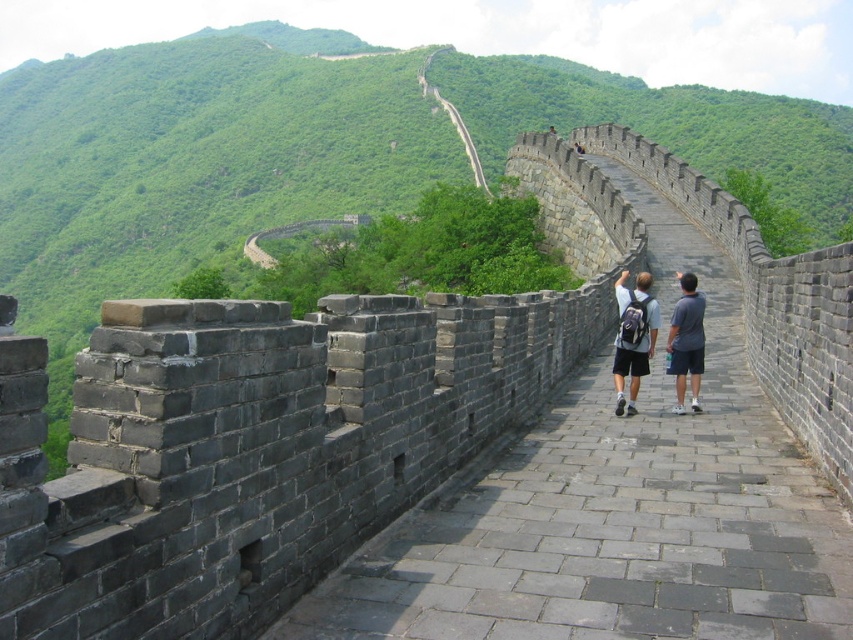
You are standing on the Great Wall of China and notice a gray backpack at center. Where exactly is the gray backpack positioned in relation to your current viewpoint?

The gray backpack at center is located at point 0.534 on the horizontal axis and 0.743 on the vertical axis relative to your viewpoint.

You are standing on the Great Wall of China and notice two points marked on the wall. The first point is at coordinates point (636, 296) and the second is at point (634, 301). Which point is closer to you?

Point (636, 296) is further to the camera than point (634, 301), so the point closer to you is point (634, 301).